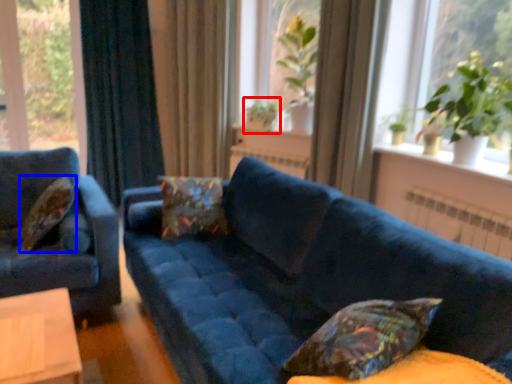
Question: Which of the following is the closest to the observer, plant (highlighted by a red box) or pillow (highlighted by a blue box)?

Choices:
 (A) plant
 (B) pillow

Answer: (B)